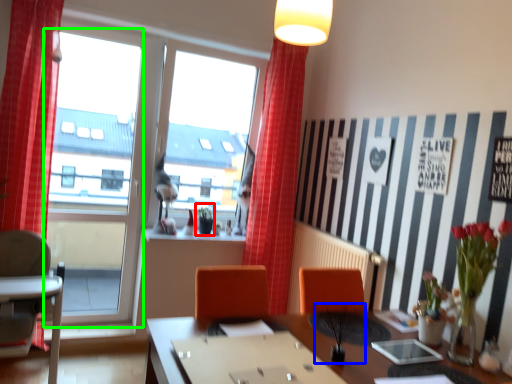
Question: Which object is positioned farthest from plant (highlighted by a red box)? Select from plant (highlighted by a blue box) and window frame (highlighted by a green box).

Choices:
 (A) plant
 (B) window frame

Answer: (A)